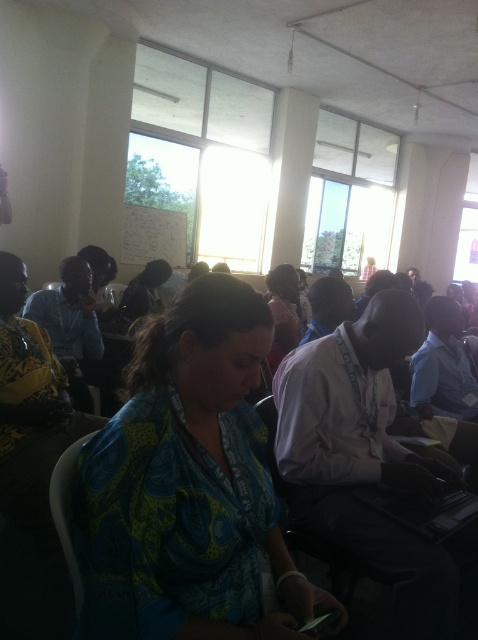
Between printed fabric shirt at center and whiteboard at upper center, which one has more height?

With more height is printed fabric shirt at center.

Between point (141, 358) and point (158, 241), which one is positioned behind?

Positioned behind is point (158, 241).

This screenshot has width=478, height=640. Find the location of `printed fabric shirt at center`. printed fabric shirt at center is located at coordinates pos(187,484).

Where is `printed fabric shirt at center`? printed fabric shirt at center is located at coordinates (187, 484).

Can you confirm if whiteboard at upper center is positioned to the right of matte pink shirt at center?

Incorrect, whiteboard at upper center is not on the right side of matte pink shirt at center.

Is point (183, 240) closer to camera compared to point (282, 289)?

That is False.

Identify the location of whiteboard at upper center. (152, 236).

Between point (175, 472) and point (295, 300), which one is positioned behind?

The point (295, 300) is more distant.

Between point (238, 573) and point (279, 339), which one is positioned in front?

Point (238, 573) is more forward.

Locate an element on the screen. Image resolution: width=478 pixels, height=640 pixels. printed fabric shirt at center is located at coordinates (187, 484).